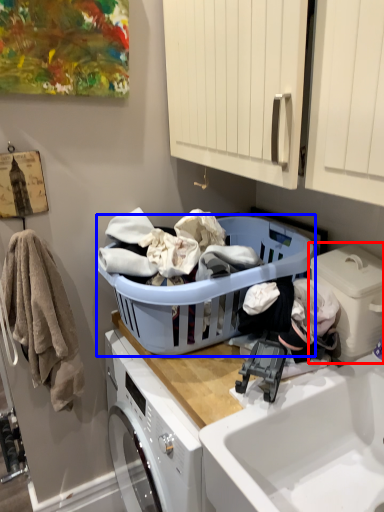
Question: Which object appears closest to the camera in this image, washing machine (highlighted by a red box) or laundry basket (highlighted by a blue box)?

Choices:
 (A) washing machine
 (B) laundry basket

Answer: (B)